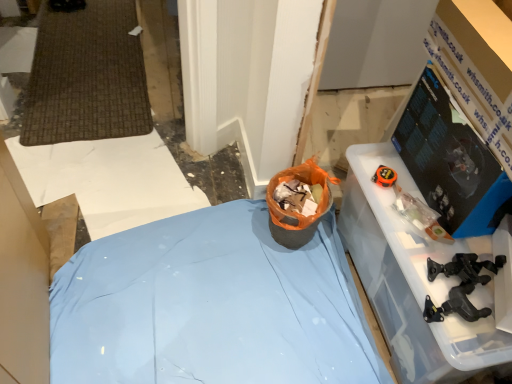
Question: Is black plastic tool at lower right not close to black glossy monitor at upper right?

Choices:
 (A) no
 (B) yes

Answer: (A)

Question: Does black plastic tool at lower right have a greater height compared to black glossy monitor at upper right?

Choices:
 (A) no
 (B) yes

Answer: (A)

Question: Is black plastic tool at lower right looking in the opposite direction of black glossy monitor at upper right?

Choices:
 (A) yes
 (B) no

Answer: (B)

Question: Can you confirm if black plastic tool at lower right is shorter than black glossy monitor at upper right?

Choices:
 (A) yes
 (B) no

Answer: (A)

Question: Is black plastic tool at lower right positioned in front of black glossy monitor at upper right?

Choices:
 (A) yes
 (B) no

Answer: (B)

Question: Would you say blue fabric bed at center, arranged as the first furniture when viewed from the left, is inside or outside black plastic tool at lower right?

Choices:
 (A) inside
 (B) outside

Answer: (B)

Question: From a real-world perspective, is blue fabric bed at center, arranged as the first furniture when viewed from the left, above or below black plastic tool at lower right?

Choices:
 (A) below
 (B) above

Answer: (A)

Question: Looking at the image, does blue fabric bed at center, the 2th furniture positioned from the right, seem bigger or smaller compared to black plastic tool at lower right?

Choices:
 (A) small
 (B) big

Answer: (B)

Question: Is blue fabric bed at center, the 2th furniture positioned from the right, taller or shorter than black plastic tool at lower right?

Choices:
 (A) short
 (B) tall

Answer: (B)

Question: Would you say transparent plastic container at right, which is counted as the 1th furniture, starting from the right, is to the left or to the right of black glossy monitor at upper right in the picture?

Choices:
 (A) right
 (B) left

Answer: (B)

Question: Relative to black glossy monitor at upper right, is transparent plastic container at right, arranged as the 2th furniture when viewed from the left, in front or behind?

Choices:
 (A) behind
 (B) front

Answer: (A)

Question: From their relative heights in the image, would you say transparent plastic container at right, which is counted as the 1th furniture, starting from the right, is taller or shorter than black glossy monitor at upper right?

Choices:
 (A) tall
 (B) short

Answer: (A)

Question: Does point (435, 289) appear closer or farther from the camera than point (404, 117)?

Choices:
 (A) closer
 (B) farther

Answer: (A)

Question: Considering the positions of black plastic tool at lower right and blue fabric bed at center, the 2th furniture positioned from the right, in the image, is black plastic tool at lower right taller or shorter than blue fabric bed at center, the 2th furniture positioned from the right,?

Choices:
 (A) tall
 (B) short

Answer: (B)

Question: Which is correct: black plastic tool at lower right is inside blue fabric bed at center, the 2th furniture positioned from the right, or outside of it?

Choices:
 (A) inside
 (B) outside

Answer: (B)